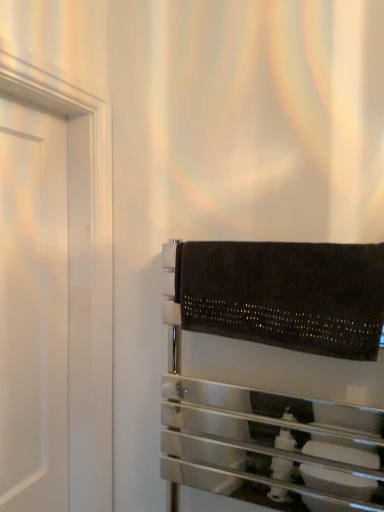
I want to click on black suede towel at lower right, so coord(285,294).

Measure the distance between black suede towel at lower right and camera.

A distance of 35.05 inches exists between black suede towel at lower right and camera.

What do you see at coordinates (285, 294) in the screenshot?
I see `black suede towel at lower right` at bounding box center [285, 294].

In order to face black textured towel rack at right, should I rotate leftwards or rightwards?

To align with it, rotate right about 9.228°.

The image size is (384, 512). I want to click on black textured towel rack at right, so click(x=275, y=373).

Describe the element at coordinates (275, 373) in the screenshot. I see `black textured towel rack at right` at that location.

Identify the location of black suede towel at lower right. (285, 294).

Is black textured towel rack at right to the left or to the right of black suede towel at lower right in the image?

Clearly, black textured towel rack at right is on the left of black suede towel at lower right in the image.

Considering their positions, is black textured towel rack at right located in front of or behind black suede towel at lower right?

Clearly, black textured towel rack at right is in front of black suede towel at lower right.

Is point (333, 511) positioned behind point (286, 252)?

Yes, point (333, 511) is behind point (286, 252).

From the image's perspective, who appears lower, black textured towel rack at right or black suede towel at lower right?

From the image's view, black textured towel rack at right is below.

From a real-world perspective, is black textured towel rack at right on black suede towel at lower right?

No, from a real-world perspective, black textured towel rack at right is not above black suede towel at lower right.

Between black textured towel rack at right and black suede towel at lower right, which one has larger width?

black textured towel rack at right.

Between black textured towel rack at right and black suede towel at lower right, which one has less height?

black suede towel at lower right is shorter.

Who is smaller, black textured towel rack at right or black suede towel at lower right?

With smaller size is black suede towel at lower right.

Is black textured towel rack at right inside or outside of black suede towel at lower right?

black textured towel rack at right is not enclosed by black suede towel at lower right.

Would you consider black textured towel rack at right to be distant from black suede towel at lower right?

No.

Is black textured towel rack at right oriented towards black suede towel at lower right?

Yes, black textured towel rack at right is oriented towards black suede towel at lower right.

How different are the orientations of black textured towel rack at right and black suede towel at lower right in degrees?

The angular difference between black textured towel rack at right and black suede towel at lower right is 0.00334 degrees.

Measure the distance from black textured towel rack at right to black suede towel at lower right.

The distance of black textured towel rack at right from black suede towel at lower right is 45.89 centimeters.

Locate an element on the screen. The width and height of the screenshot is (384, 512). bath towel lying on the right of black textured towel rack at right is located at coordinates (285, 294).

Does black suede towel at lower right appear on the left side of black textured towel rack at right?

No, black suede towel at lower right is not to the left of black textured towel rack at right.

Does black suede towel at lower right lie in front of black textured towel rack at right?

No.

Which point is more distant from viewer, (318, 288) or (308, 353)?

The point (308, 353) is farther.

From the image's perspective, does black suede towel at lower right appear higher than black textured towel rack at right?

Indeed, from the image's perspective, black suede towel at lower right is shown above black textured towel rack at right.

From a real-world perspective, is black suede towel at lower right physically below black textured towel rack at right?

No.

Is black suede towel at lower right wider than black textured towel rack at right?

No.

Which of these two, black suede towel at lower right or black textured towel rack at right, stands shorter?

With less height is black suede towel at lower right.

Who is bigger, black suede towel at lower right or black textured towel rack at right?

black textured towel rack at right is bigger.

Is black textured towel rack at right inside black suede towel at lower right?

No, black textured towel rack at right is not inside black suede towel at lower right.

Is black suede towel at lower right directly adjacent to black textured towel rack at right?

No, black suede towel at lower right is not making contact with black textured towel rack at right.

Is black suede towel at lower right facing towards black textured towel rack at right?

Yes, black suede towel at lower right is oriented towards black textured towel rack at right.

You are a GUI agent. You are given a task and a screenshot of the screen. Output one action in this format:
    pyautogui.click(x=<x>, y=<y>)
    Task: Click on the bath towel lying on the right of black textured towel rack at right
    This screenshot has height=512, width=384.
    Given the screenshot: What is the action you would take?
    pyautogui.click(x=285, y=294)

Identify the location of towel rack lying in front of the black suede towel at lower right. This screenshot has width=384, height=512. (275, 373).

Identify the location of towel rack directly beneath the black suede towel at lower right (from a real-world perspective). Image resolution: width=384 pixels, height=512 pixels. (275, 373).